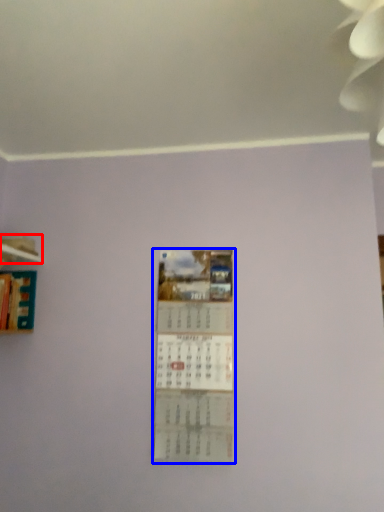
Question: Which of the following is the farthest to the observer, shelf (highlighted by a red box) or poster (highlighted by a blue box)?

Choices:
 (A) shelf
 (B) poster

Answer: (A)